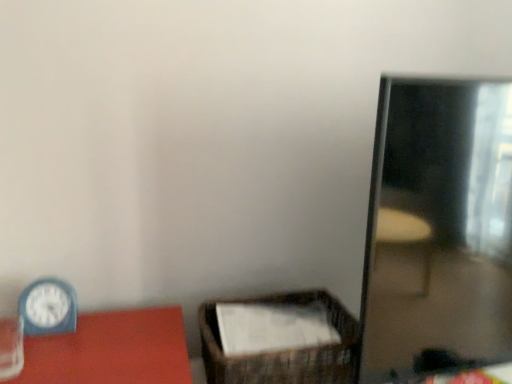
What do you see at coordinates (332, 348) in the screenshot?
I see `brown woven basket at center` at bounding box center [332, 348].

Locate an element on the screen. The image size is (512, 384). brown woven basket at center is located at coordinates (332, 348).

Find the location of `shiny reflective mirror at right`. shiny reflective mirror at right is located at coordinates (438, 222).

The width and height of the screenshot is (512, 384). Describe the element at coordinates (438, 222) in the screenshot. I see `shiny reflective mirror at right` at that location.

At what (x,y) coordinates should I click in order to perform the action: click on brown woven basket at center. Please return your answer as a coordinate pair (x, y). The height and width of the screenshot is (384, 512). Looking at the image, I should click on (332, 348).

Find the location of a particular element. Image resolution: width=512 pixels, height=384 pixels. mirror above the blue plastic clock at left (from the image's perspective) is located at coordinates (438, 222).

From a real-world perspective, is shiny reflective mirror at right positioned under blue plastic clock at left based on gravity?

No, from a real-world perspective, shiny reflective mirror at right is not under blue plastic clock at left.

From the image's perspective, which one is positioned lower, shiny reflective mirror at right or blue plastic clock at left?

blue plastic clock at left appears lower in the image.

Is shiny reflective mirror at right shorter than blue plastic clock at left?

No.

Looking at this image, is shiny reflective mirror at right shorter than brown woven basket at center?

In fact, shiny reflective mirror at right may be taller than brown woven basket at center.

Consider the image. Relative to brown woven basket at center, is shiny reflective mirror at right in front or behind?

Clearly, shiny reflective mirror at right is in front of brown woven basket at center.

Considering the points (393, 366) and (255, 364), which point is in front, point (393, 366) or point (255, 364)?

The point (255, 364) is closer.

From the image's perspective, is shiny reflective mirror at right over brown woven basket at center?

Yes, from the image's perspective, shiny reflective mirror at right is on top of brown woven basket at center.

From a real-world perspective, who is located lower, brown woven basket at center or blue plastic clock at left?

brown woven basket at center.

Could you tell me if brown woven basket at center is facing blue plastic clock at left?

No, brown woven basket at center does not turn towards blue plastic clock at left.

Considering the sizes of brown woven basket at center and blue plastic clock at left in the image, is brown woven basket at center wider or thinner than blue plastic clock at left?

In the image, brown woven basket at center appears to be wider than blue plastic clock at left.

From the image's perspective, between brown woven basket at center and blue plastic clock at left, who is located below?

From the image's view, brown woven basket at center is below.

Between blue plastic clock at left and shiny reflective mirror at right, which one has smaller width?

blue plastic clock at left.

Does blue plastic clock at left turn towards shiny reflective mirror at right?

No.

Consider the image. From the image's perspective, is blue plastic clock at left on shiny reflective mirror at right?

No.

How different are the orientations of blue plastic clock at left and shiny reflective mirror at right in degrees?

The angle between the facing direction of blue plastic clock at left and the facing direction of shiny reflective mirror at right is 4.37 degrees.

Based on the photo, from the image's perspective, which one is positioned higher, blue plastic clock at left or brown woven basket at center?

blue plastic clock at left.

Is blue plastic clock at left smaller than brown woven basket at center?

Correct, blue plastic clock at left occupies less space than brown woven basket at center.

Can you tell me how much blue plastic clock at left and brown woven basket at center differ in facing direction?

The angular difference between blue plastic clock at left and brown woven basket at center is 3.25 degrees.

In terms of width, does blue plastic clock at left look wider or thinner when compared to brown woven basket at center?

blue plastic clock at left is thinner than brown woven basket at center.

Is brown woven basket at center behind shiny reflective mirror at right?

Yes, brown woven basket at center is behind shiny reflective mirror at right.

Is brown woven basket at center facing towards shiny reflective mirror at right?

No, brown woven basket at center is not aimed at shiny reflective mirror at right.

Would you say brown woven basket at center is inside or outside shiny reflective mirror at right?

brown woven basket at center is located beyond the bounds of shiny reflective mirror at right.

Can you confirm if brown woven basket at center is positioned to the left of shiny reflective mirror at right?

Indeed, brown woven basket at center is positioned on the left side of shiny reflective mirror at right.

Image resolution: width=512 pixels, height=384 pixels. I want to click on clock below the shiny reflective mirror at right (from a real-world perspective), so [48, 307].

This screenshot has width=512, height=384. I want to click on basket that appears behind the shiny reflective mirror at right, so click(332, 348).

In the scene shown: From the image, which object appears to be nearer to blue plastic clock at left, brown woven basket at center or shiny reflective mirror at right?

Based on the image, brown woven basket at center appears to be nearer to blue plastic clock at left.

Considering their positions, is blue plastic clock at left positioned further to shiny reflective mirror at right than brown woven basket at center?

blue plastic clock at left is positioned further to the anchor shiny reflective mirror at right.

Estimate the real-world distances between objects in this image. Which object is closer to brown woven basket at center, shiny reflective mirror at right or blue plastic clock at left?

shiny reflective mirror at right lies closer to brown woven basket at center than the other object.

From the image, which object appears to be nearer to brown woven basket at center, blue plastic clock at left or shiny reflective mirror at right?

Among the two, shiny reflective mirror at right is located nearer to brown woven basket at center.

Based on their spatial positions, is brown woven basket at center or blue plastic clock at left further from shiny reflective mirror at right?

Based on the image, blue plastic clock at left appears to be further to shiny reflective mirror at right.

Estimate the real-world distances between objects in this image. Which object is closer to blue plastic clock at left, shiny reflective mirror at right or brown woven basket at center?

brown woven basket at center.

Identify the location of basket located between blue plastic clock at left and shiny reflective mirror at right in the left-right direction. (332, 348).